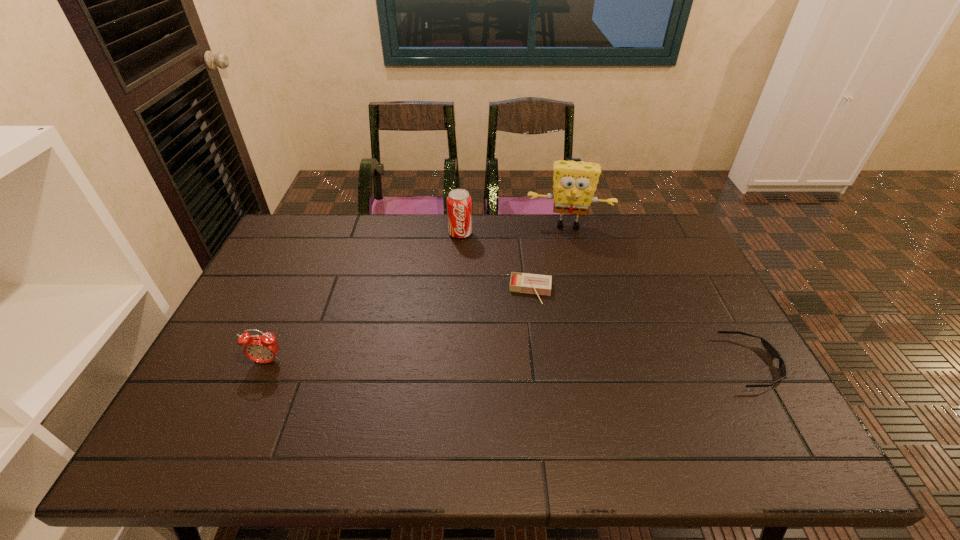
Identify the location of free space located on the logo side of the second tallest object. The width and height of the screenshot is (960, 540). click(461, 259).

Locate an element on the screen. This screenshot has width=960, height=540. free space located 0.380m on the logo side of the second tallest object is located at coordinates click(462, 323).

Locate an element on the screen. The width and height of the screenshot is (960, 540). free space located 0.380m on the logo side of the second tallest object is located at coordinates (462, 323).

Find the location of a particular element. This screenshot has width=960, height=540. vacant space located 0.090m on the face of the sponge is located at coordinates (564, 251).

Where is `free region located 0.290m on the face of the sponge`? This screenshot has height=540, width=960. free region located 0.290m on the face of the sponge is located at coordinates (564, 292).

The height and width of the screenshot is (540, 960). I want to click on blank area located on the face of the sponge, so click(x=564, y=264).

Locate an element on the screen. blank space located 0.350m on the striking surface of the matchbox is located at coordinates (518, 410).

The image size is (960, 540). Identify the location of vacant space positioned on the striking surface of the matchbox. (522, 375).

Where is `blank space located 0.290m on the striking surface of the matchbox`? The height and width of the screenshot is (540, 960). blank space located 0.290m on the striking surface of the matchbox is located at coordinates pyautogui.click(x=521, y=388).

The height and width of the screenshot is (540, 960). Identify the location of soda can present at the far edge. (459, 203).